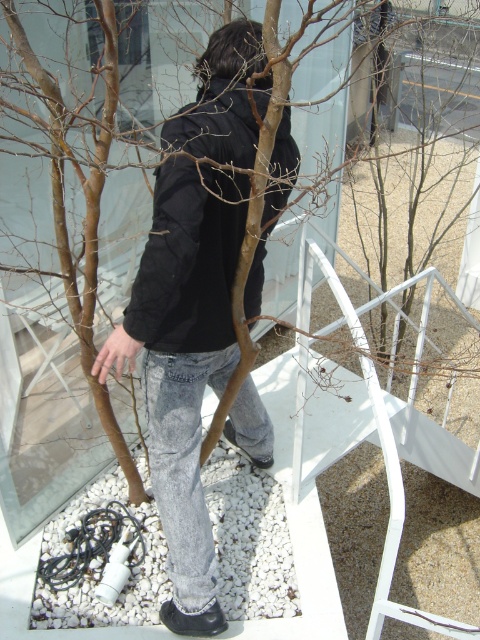
You are a photographer aiming to capture the black matte jacket at center in your shot. Given that your camera is focused on the point at coordinates point (183, 362), which object should you ensure is in focus to get a clear image of the black matte jacket at center?

The point (183, 362) marks the black matte jacket at center, so focusing on that point will ensure the black matte jacket at center is in focus.